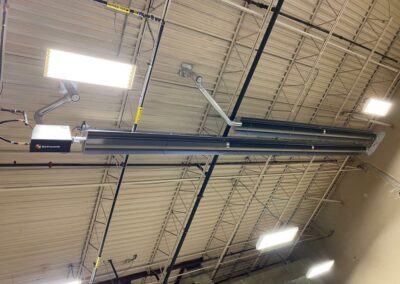
Locate an element on the screen. brand of light fixtures is located at coordinates (48, 146).